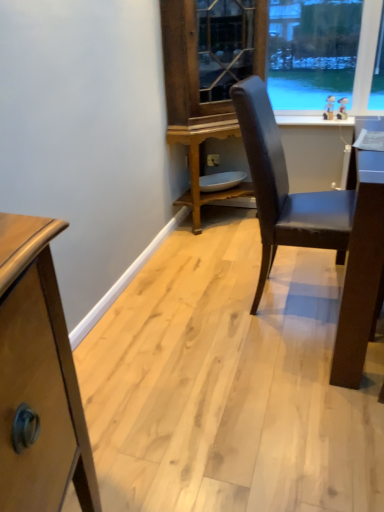
Identify the location of white plastic power outlet at center. (213, 160).

You are a GUI agent. You are given a task and a screenshot of the screen. Output one action in this format:
    pyautogui.click(x=<x>, y=<y>)
    Task: Click on the white glossy window sill at upper right
    The image size is (384, 512).
    Given the screenshot: What is the action you would take?
    pyautogui.click(x=312, y=121)

Which of these two, wooden cabinet at center or white glossy window sill at upper right, stands shorter?

With less height is white glossy window sill at upper right.

In the image, is wooden cabinet at center positioned in front of or behind white glossy window sill at upper right?

wooden cabinet at center is in front of white glossy window sill at upper right.

From a real-world perspective, between wooden cabinet at center and white glossy window sill at upper right, who is vertically higher?

wooden cabinet at center.

Is wooden cabinet at center positioned far away from matte black chair at center?

Yes, wooden cabinet at center and matte black chair at center are quite far apart.

Considering the sizes of objects wooden cabinet at center and matte black chair at center in the image provided, who is taller, wooden cabinet at center or matte black chair at center?

Standing taller between the two is wooden cabinet at center.

Is matte black chair at center at the back of wooden cabinet at center?

No, wooden cabinet at center is not facing the opposite direction of matte black chair at center.

Which of these two, wooden cabinet at center or matte black chair at center, is smaller?

matte black chair at center.

Is matte black chair at center further to camera compared to white plastic power outlet at center?

No, the depth of matte black chair at center is less than that of white plastic power outlet at center.

From a real-world perspective, relative to white plastic power outlet at center, is matte black chair at center vertically above or below?

matte black chair at center is situated higher than white plastic power outlet at center in the real world.

Based on the photo, from the image's perspective, would you say matte black chair at center is positioned over white plastic power outlet at center?

No.

From the picture: Considering the relative positions of white glossy window sill at upper right and matte black chair at center in the image provided, is white glossy window sill at upper right in front of matte black chair at center?

That is False.

Which object is thinner, white glossy window sill at upper right or matte black chair at center?

white glossy window sill at upper right is thinner.

From the image's perspective, is white glossy window sill at upper right on top of matte black chair at center?

Correct, white glossy window sill at upper right appears higher than matte black chair at center in the image.

Between white glossy window sill at upper right and wooden cabinet at center, which one has smaller size?

With smaller size is white glossy window sill at upper right.

From a real-world perspective, is white glossy window sill at upper right positioned under wooden cabinet at center based on gravity?

Yes, from a real-world perspective, white glossy window sill at upper right is below wooden cabinet at center.

What's the angular difference between white glossy window sill at upper right and wooden cabinet at center's facing directions?

0.000193 degrees separate the facing orientations of white glossy window sill at upper right and wooden cabinet at center.

Is point (317, 115) positioned behind point (337, 160)?

Yes, it is.

Is wooden cabinet at center facing towards white plastic power outlet at center?

Yes, wooden cabinet at center faces towards white plastic power outlet at center.

Is wooden cabinet at center positioned beyond the bounds of white plastic power outlet at center?

wooden cabinet at center lies outside white plastic power outlet at center's area.

Considering the relative sizes of wooden cabinet at center and white plastic power outlet at center in the image provided, is wooden cabinet at center bigger than white plastic power outlet at center?

Correct, wooden cabinet at center is larger in size than white plastic power outlet at center.

Considering the positions of objects wooden cabinet at center and white plastic power outlet at center in the image provided, who is more to the right, wooden cabinet at center or white plastic power outlet at center?

wooden cabinet at center.

Which of these two, white plastic power outlet at center or matte black chair at center, is wider?

matte black chair at center.

Considering the positions of objects white plastic power outlet at center and matte black chair at center in the image provided, who is behind, white plastic power outlet at center or matte black chair at center?

white plastic power outlet at center is more distant.

Is white plastic power outlet at center in contact with matte black chair at center?

white plastic power outlet at center and matte black chair at center are not in contact.

Between white plastic power outlet at center and matte black chair at center, which one has larger size?

Bigger between the two is matte black chair at center.

Where is `dresser located above the white glossy window sill at upper right (from a real-world perspective)`? Image resolution: width=384 pixels, height=512 pixels. dresser located above the white glossy window sill at upper right (from a real-world perspective) is located at coordinates (324, 59).

In the image, there is a matte black chair at center. Where is `dresser above it (from the image's perspective)`? The image size is (384, 512). dresser above it (from the image's perspective) is located at coordinates (324, 59).

From the picture: Based on their spatial positions, is white glossy window sill at upper right or wooden cabinet at center closer to white plastic power outlet at center?

Based on the image, white glossy window sill at upper right appears to be nearer to white plastic power outlet at center.

Estimate the real-world distances between objects in this image. Which object is further from matte black chair at center, wooden cabinet at center or white plastic power outlet at center?

white plastic power outlet at center.

Considering their positions, is white plastic power outlet at center positioned further to matte black chair at center than wooden cabinet at center?

white plastic power outlet at center lies further to matte black chair at center than the other object.

Based on their spatial positions, is wooden cabinet at center or white glossy window sill at upper right further from matte black chair at center?

white glossy window sill at upper right is positioned further to the anchor matte black chair at center.

Considering their positions, is matte black chair at center positioned further to white glossy window sill at upper right than white plastic power outlet at center?

The object further to white glossy window sill at upper right is matte black chair at center.

Based on their spatial positions, is white glossy window sill at upper right or white plastic power outlet at center further from wooden cabinet at center?

The object further to wooden cabinet at center is white plastic power outlet at center.

Estimate the real-world distances between objects in this image. Which object is further from white glossy window sill at upper right, white plastic power outlet at center or matte black chair at center?

The object further to white glossy window sill at upper right is matte black chair at center.

Estimate the real-world distances between objects in this image. Which object is closer to wooden cabinet at center, matte black chair at center or white plastic power outlet at center?

white plastic power outlet at center lies closer to wooden cabinet at center than the other object.

You are a GUI agent. You are given a task and a screenshot of the screen. Output one action in this format:
    pyautogui.click(x=<x>, y=<y>)
    Task: Click on the window sill between matte black chair at center and white plastic power outlet at center in the front-back direction
    The image size is (384, 512).
    Given the screenshot: What is the action you would take?
    pyautogui.click(x=312, y=121)

At what (x,y) coordinates should I click in order to perform the action: click on window sill between wooden cabinet at center and white plastic power outlet at center along the z-axis. Please return your answer as a coordinate pair (x, y). Looking at the image, I should click on (312, 121).

Locate an element on the screen. This screenshot has width=384, height=512. dresser positioned between matte black chair at center and white plastic power outlet at center from near to far is located at coordinates (324, 59).

Image resolution: width=384 pixels, height=512 pixels. Identify the location of dresser between matte black chair at center and white glossy window sill at upper right along the z-axis. tap(324, 59).